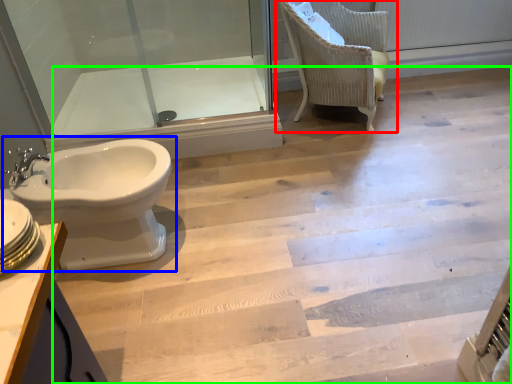
Question: Which is nearer to the chair (highlighted by a red box)? toilet (highlighted by a blue box) or stairwell (highlighted by a green box).

Choices:
 (A) toilet
 (B) stairwell

Answer: (B)